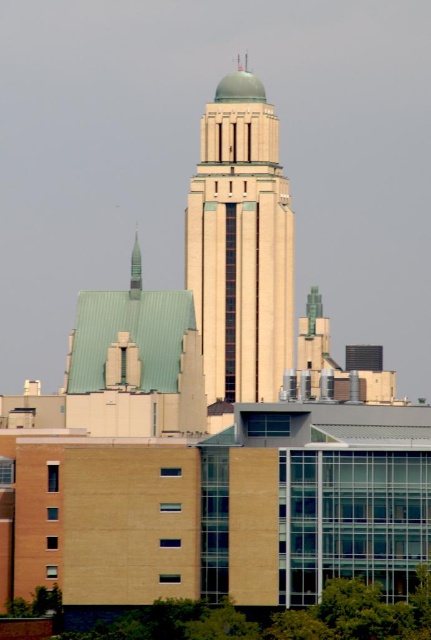
Question: Among these objects, which one is nearest to the camera?

Choices:
 (A) beige concrete tower at center
 (B) green matte spire at upper center

Answer: (B)

Question: From the image, what is the correct spatial relationship of beige concrete tower at center in relation to green matte spire at upper center?

Choices:
 (A) right
 (B) left

Answer: (A)

Question: Which object appears closest to the camera in this image?

Choices:
 (A) green matte spire at upper center
 (B) beige concrete tower at center

Answer: (A)

Question: Can you confirm if beige concrete tower at center is positioned to the right of green matte spire at upper center?

Choices:
 (A) no
 (B) yes

Answer: (B)

Question: In this image, where is beige concrete tower at center located relative to green matte spire at upper center?

Choices:
 (A) below
 (B) above

Answer: (B)